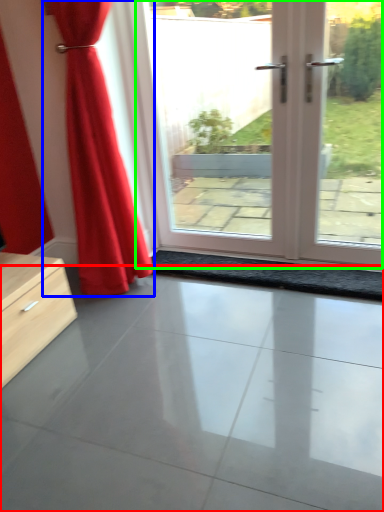
Question: Which is farther away from concrete (highlighted by a red box)? curtain (highlighted by a blue box) or door (highlighted by a green box)?

Choices:
 (A) curtain
 (B) door

Answer: (B)